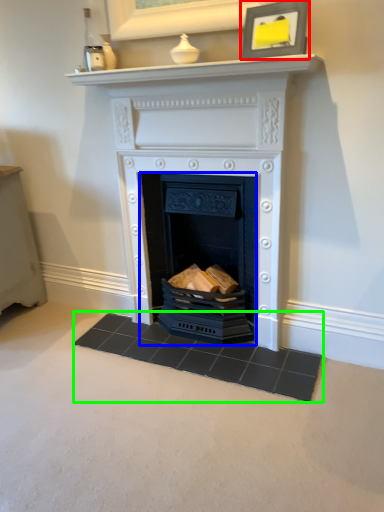
Question: Considering the real-world distances, which object is closest to picture frame (highlighted by a red box)? fireplace (highlighted by a blue box) or doormat (highlighted by a green box).

Choices:
 (A) fireplace
 (B) doormat

Answer: (A)